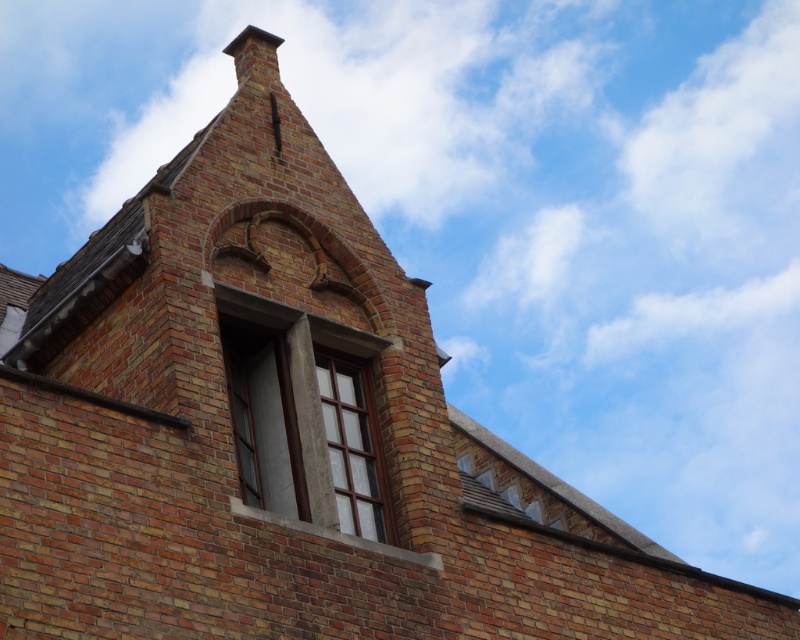
Question: Which object appears closest to the camera in this image?

Choices:
 (A) clear glass window at upper center
 (B) matte gray stone window at center

Answer: (B)

Question: Does matte glass window at center appear under clear glass window at upper center?

Choices:
 (A) no
 (B) yes

Answer: (B)

Question: Which point is farther to the camera?

Choices:
 (A) matte glass window at center
 (B) clear glass window at upper center

Answer: (A)

Question: Observing the image, what is the correct spatial positioning of matte glass window at center in reference to clear glass window at upper center?

Choices:
 (A) right
 (B) left

Answer: (A)

Question: Is matte glass window at center smaller than clear glass window at upper center?

Choices:
 (A) no
 (B) yes

Answer: (B)

Question: Among these objects, which one is farthest from the camera?

Choices:
 (A) matte glass window at center
 (B) clear glass window at upper center
 (C) matte gray stone window at center

Answer: (A)